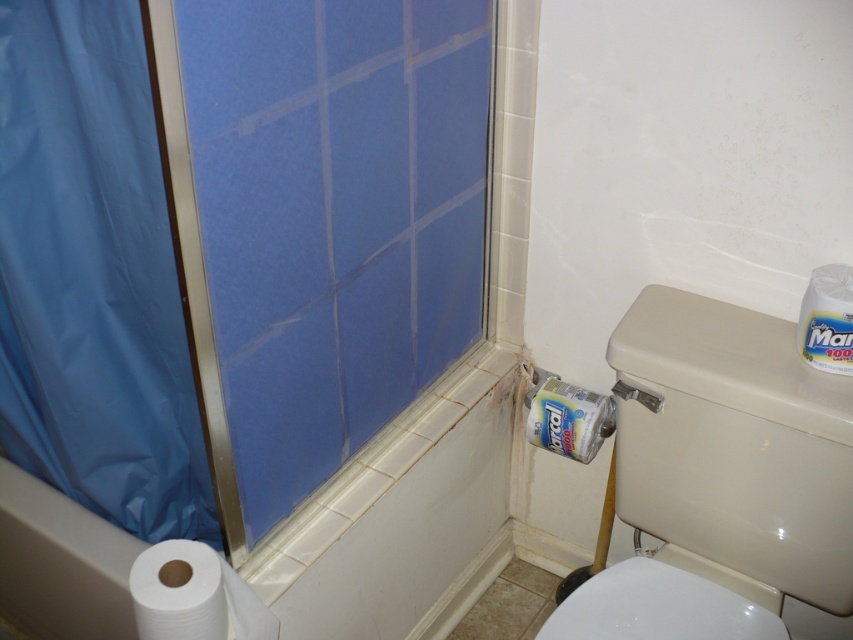
You are standing in the bathroom shown in the image. You need to locate the point at coordinate point (91,275). Based on the scene description, where exactly is this point located?

The point at coordinate point (91,275) is located on the blue plastic shower curtain at left.

You are a bathroom designer planning to install a new rack between the blue plastic shower curtain at left and the matte plastic toilet paper holder at lower right. The rack requires a minimum of 36 inches of space between the two objects. Based on the current distance, will the rack fit?

The blue plastic shower curtain at left and the matte plastic toilet paper holder at lower right are 32.97 inches apart, which is less than the required 36 inches. Therefore, the rack will not fit between them.

You are a bathroom cleaner who needs to reach both the white paper at lower left and the white glossy toilet paper at upper right. Which object is taller so you might need a step stool to reach it?

The white paper at lower left has a greater height compared to the white glossy toilet paper at upper right, so you might need a step stool to reach the white paper at lower left.